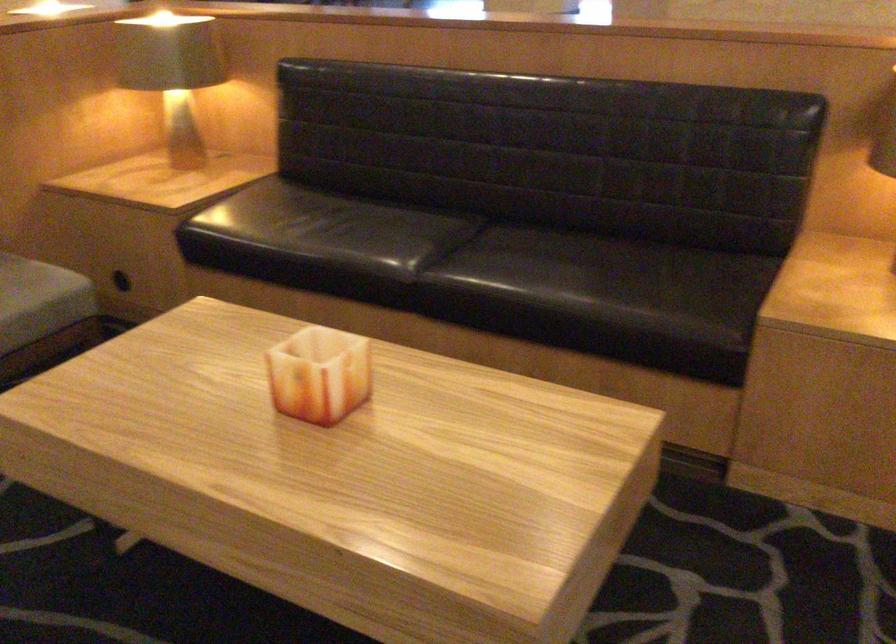
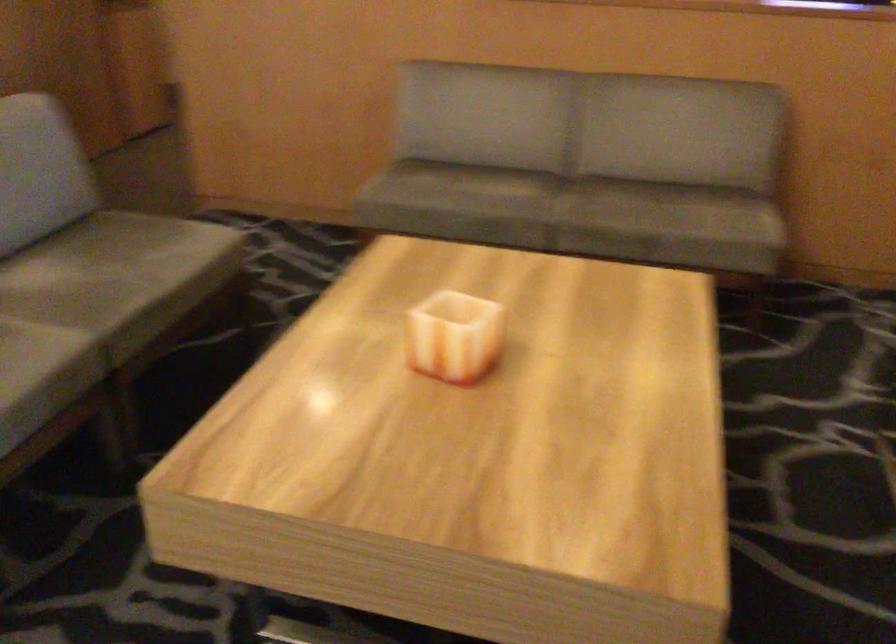
How did the camera likely rotate?

The rotation direction of the camera is left-down.